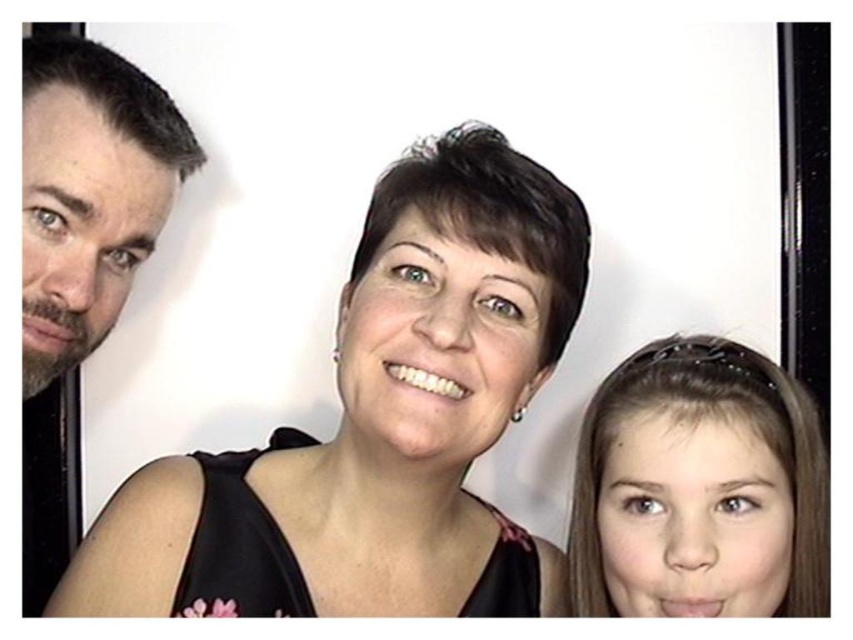
You are a photographer trying to adjust the lighting for a group photo. You notice the black fabric at center and the dark brown hair at left. Which object should you focus on to ensure proper exposure, considering their size differences?

The black fabric at center is larger in size than the dark brown hair at left, so focusing on the black fabric at center would ensure proper exposure due to its larger surface area.

You are a photographer trying to adjust the lighting for a photo shoot. You notice two elements in the image that might affect the lighting setup. The first is the black fabric at center, and the second is the smooth brown hair at lower right. Which of these two elements requires more careful consideration for lighting adjustments to avoid harsh shadows?

The black fabric at center requires more careful consideration for lighting adjustments because black fabrics tend to absorb more light and can create deeper shadows compared to lighter or smoother surfaces like the smooth brown hair at lower right.

You are a photographer adjusting the lighting for a portrait. You notice the black fabric at center and the dark brown hair at left. Which object is positioned closer to the camera?

The black fabric at center is closer to the viewer than the dark brown hair at left, so the black fabric at center is positioned closer to the camera.